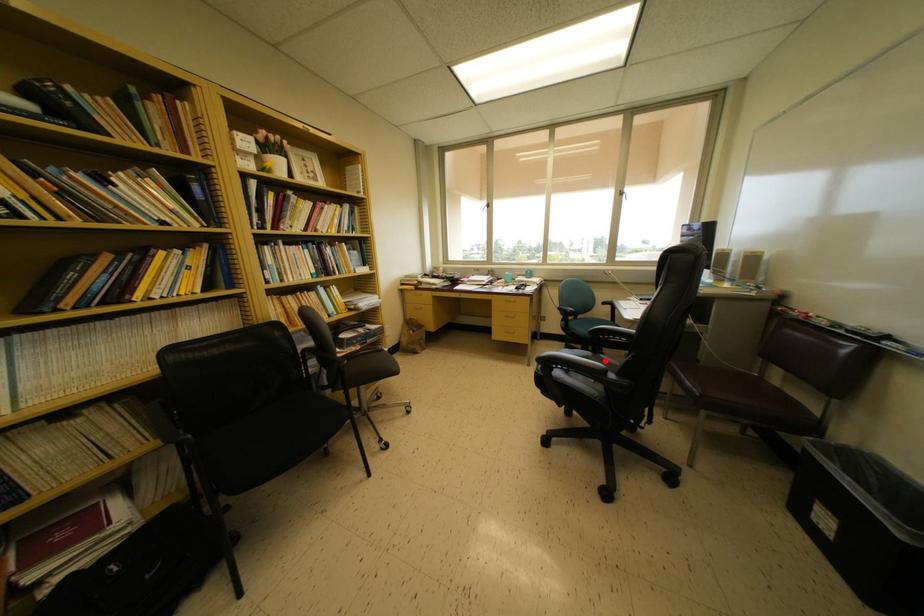
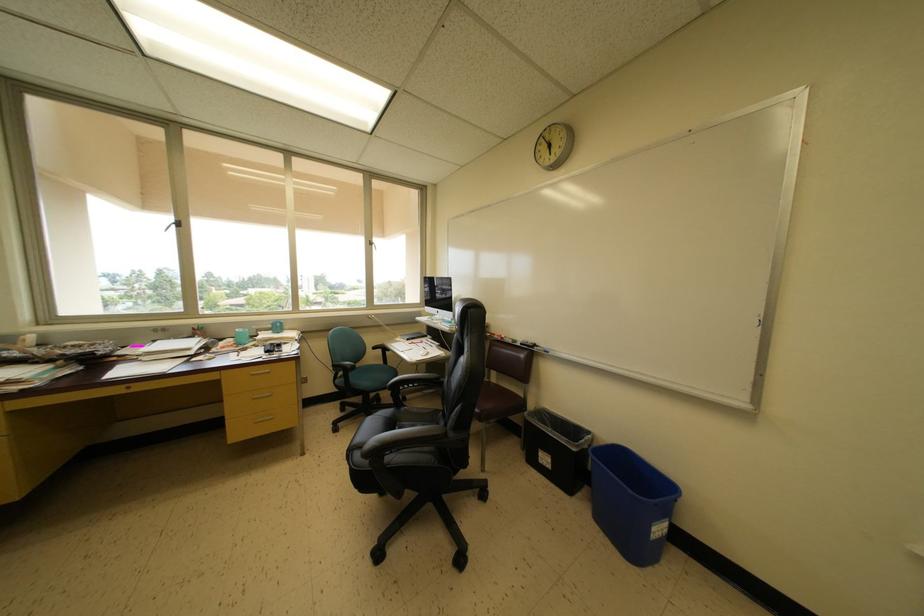
Question: I am providing you with two images of the same scene from different viewpoints. A red point is marked on the first image. Can you still see the location of the red point in image 2?

Choices:
 (A) Yes
 (B) No

Answer: (A)